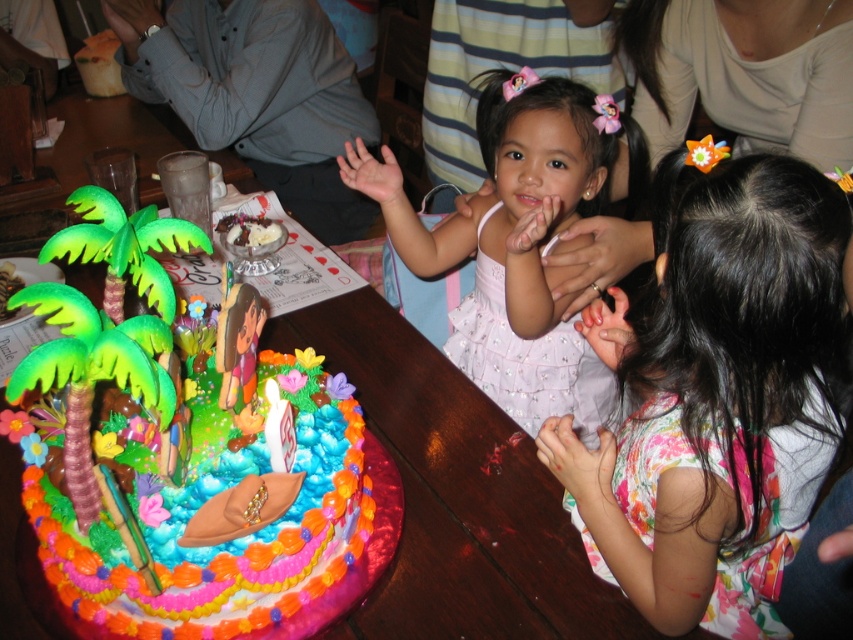
Can you confirm if floral fabric dress at center is wider than pink satin dress at center?

Incorrect, floral fabric dress at center's width does not surpass pink satin dress at center's.

Can you confirm if floral fabric dress at center is shorter than pink satin dress at center?

Yes.

Is point (804, 467) positioned behind point (541, 84)?

No, (804, 467) is in front of (541, 84).

This screenshot has height=640, width=853. I want to click on floral fabric dress at center, so click(x=715, y=396).

Does multicolored fondant cake at left have a greater width compared to pink satin dress at center?

Incorrect, multicolored fondant cake at left's width does not surpass pink satin dress at center's.

Is multicolored fondant cake at left taller than pink satin dress at center?

Incorrect, multicolored fondant cake at left's height is not larger of pink satin dress at center's.

Is point (131, 385) positioned before point (544, 154)?

Yes, it is.

Find the location of a particular element. The height and width of the screenshot is (640, 853). multicolored fondant cake at left is located at coordinates (198, 481).

Is the position of multicolored fondant cake at left less distant than that of white paper birthday candle at center?

Yes, multicolored fondant cake at left is closer to the viewer.

Which is behind, point (309, 502) or point (264, 426)?

Positioned behind is point (309, 502).

Where is `multicolored fondant cake at left`? This screenshot has height=640, width=853. multicolored fondant cake at left is located at coordinates (198, 481).